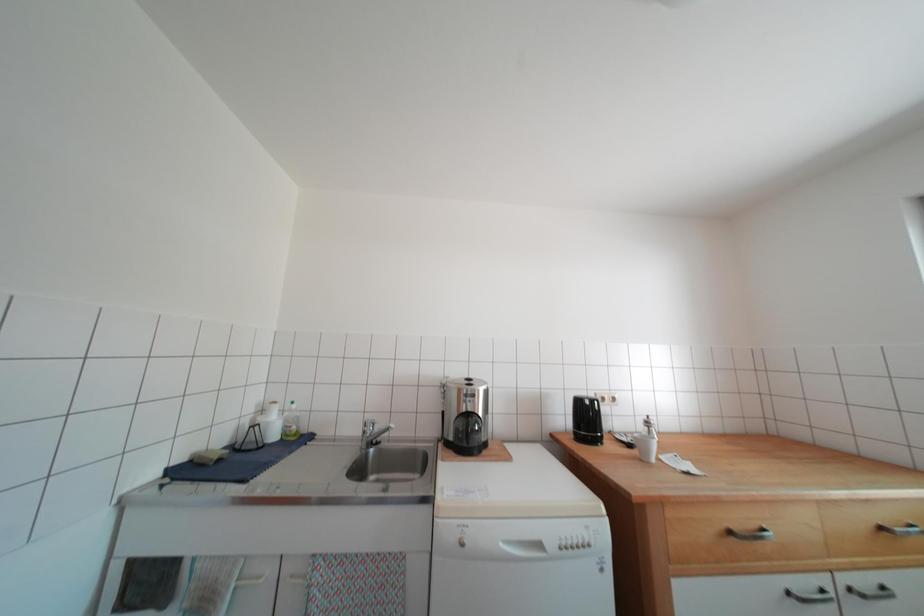
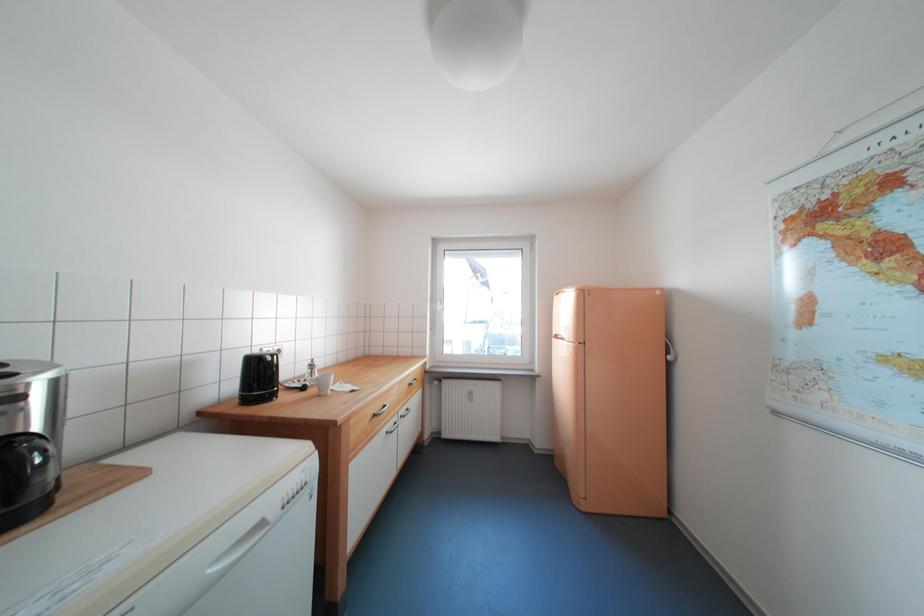
Question: The camera is either moving clockwise (left) or counter-clockwise (right) around the object. The first image is from the beginning of the video and the second image is from the end. Is the camera moving left or right when shooting the video?

Choices:
 (A) Left
 (B) Right

Answer: (A)